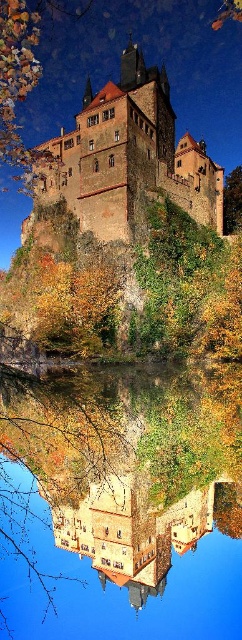
Question: In this image, where is transparent glass water at center located relative to brown stone castle at upper center?

Choices:
 (A) below
 (B) above

Answer: (A)

Question: Does brown stone castle at upper center have a lesser width compared to green leafy tree at center?

Choices:
 (A) yes
 (B) no

Answer: (B)

Question: Among these points, which one is nearest to the camera?

Choices:
 (A) (115, 184)
 (B) (168, 589)

Answer: (A)

Question: Which object appears closest to the camera in this image?

Choices:
 (A) brown stone castle at upper center
 (B) green leafy tree at center

Answer: (A)

Question: Among these objects, which one is farthest from the camera?

Choices:
 (A) brown stone castle at upper center
 (B) transparent glass water at center
 (C) green leafy tree at center

Answer: (C)

Question: Is transparent glass water at center smaller than green leafy tree at center?

Choices:
 (A) no
 (B) yes

Answer: (A)